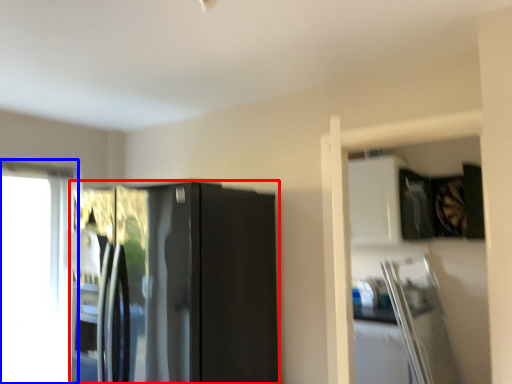
Question: Among these objects, which one is nearest to the camera, refrigerator (highlighted by a red box) or window (highlighted by a blue box)?

Choices:
 (A) refrigerator
 (B) window

Answer: (A)